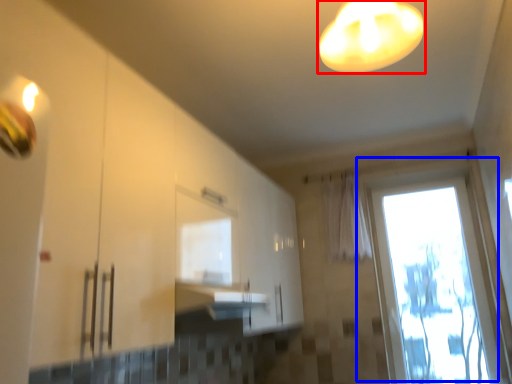
Question: Among these objects, which one is nearest to the camera, lamp (highlighted by a red box) or window (highlighted by a blue box)?

Choices:
 (A) lamp
 (B) window

Answer: (A)